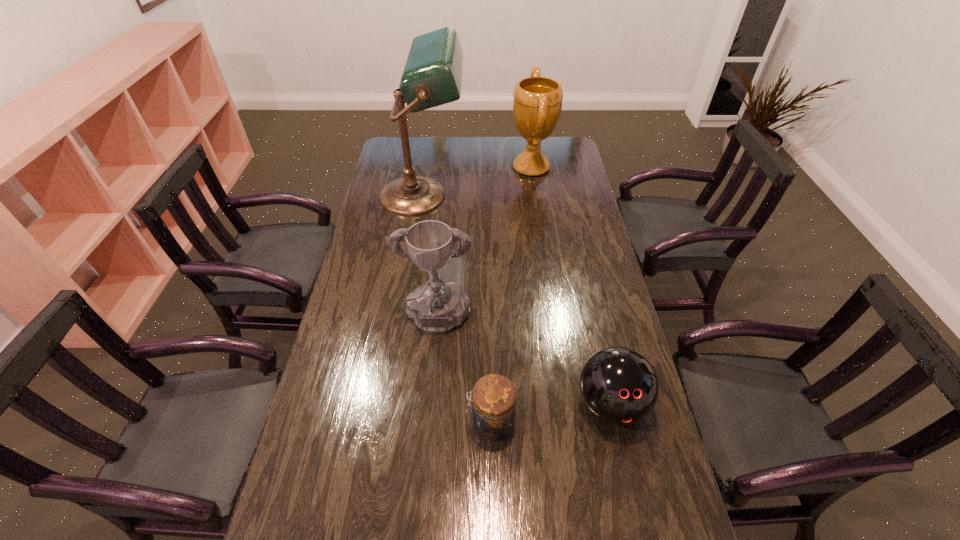
At what (x,y) coordinates should I click in order to perform the action: click on vacant area at the far edge of the desktop. Please return your answer as a coordinate pair (x, y). Looking at the image, I should click on (478, 161).

This screenshot has width=960, height=540. In the image, there is a desktop. Find the location of `vacant area at the left edge`. vacant area at the left edge is located at coordinates (328, 353).

Where is `vacant space at the right edge of the desktop`? The width and height of the screenshot is (960, 540). vacant space at the right edge of the desktop is located at coordinates (588, 284).

Find the location of `vacant region at the far right corner of the desktop`. vacant region at the far right corner of the desktop is located at coordinates (552, 155).

Identify the location of unoccupied position between the third nearest object and the bowling ball. (523, 363).

Locate an element on the screen. vacant space that is in between the tallest object and the farther award is located at coordinates (477, 182).

Where is `empty location between the third nearest object and the shortest object`? This screenshot has width=960, height=540. empty location between the third nearest object and the shortest object is located at coordinates (464, 372).

Find the location of `free space between the right award and the third nearest object`. free space between the right award and the third nearest object is located at coordinates (484, 245).

This screenshot has height=540, width=960. What are the coordinates of `free space between the left award and the bowling ball` in the screenshot? It's located at (523, 363).

Identify the location of vacant region between the fourth tallest object and the table lamp. The image size is (960, 540). (516, 300).